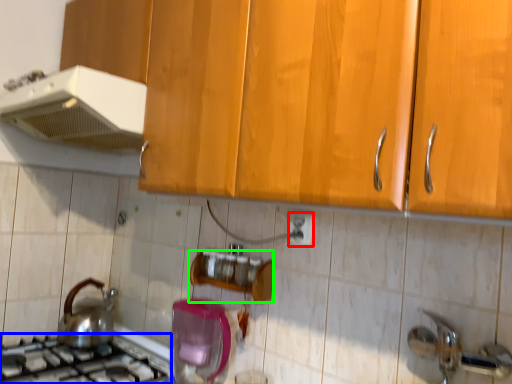
Question: Based on their relative distances, which object is farther from electric outlet (highlighted by a red box)? Choose from gas stove (highlighted by a blue box) and shelf (highlighted by a green box).

Choices:
 (A) gas stove
 (B) shelf

Answer: (A)